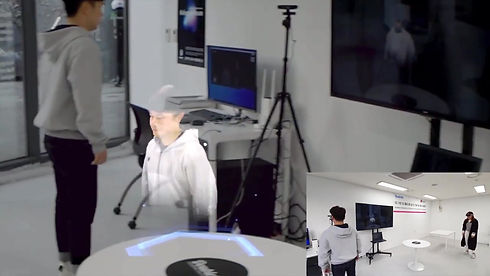
The width and height of the screenshot is (490, 276). In order to click on ceiling ventilation in this screenshot , I will do `click(408, 175)`.